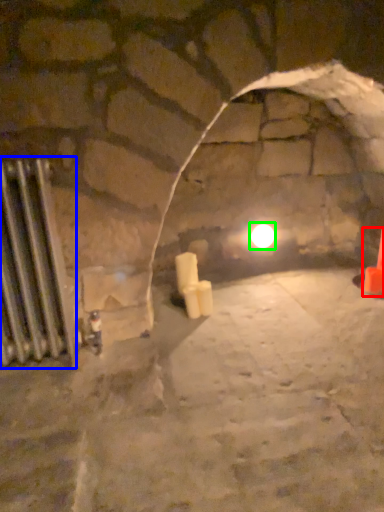
Question: Based on their relative distances, which object is farther from traffic cone (highlighted by a red box)? Choose from radiator (highlighted by a blue box) and light (highlighted by a green box).

Choices:
 (A) radiator
 (B) light

Answer: (A)